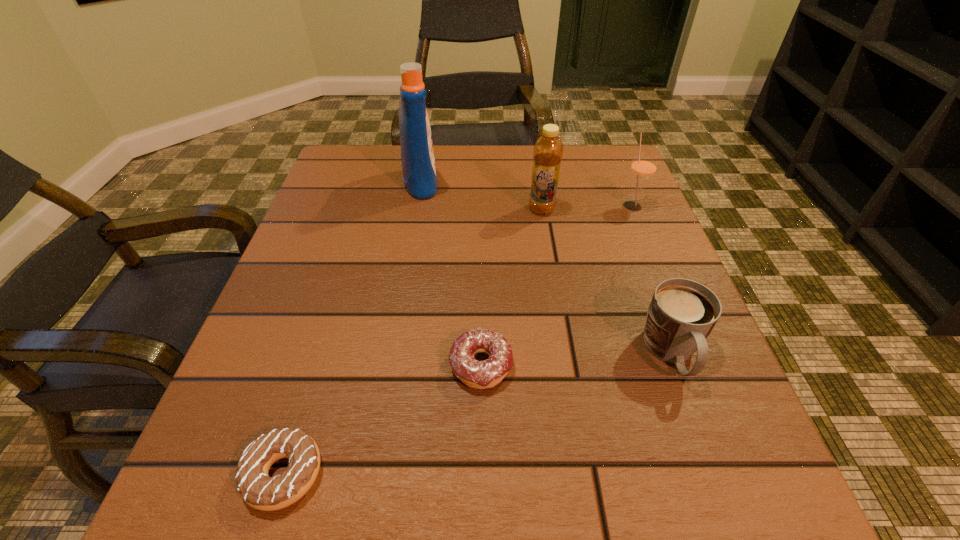
This screenshot has width=960, height=540. In order to click on vacant space at the near right corner of the desktop in this screenshot , I will do pyautogui.click(x=688, y=510).

I want to click on free area in between the fifth shortest object and the third tallest object, so click(x=587, y=207).

Locate an element on the screen. vacant space in between the farther doughnut and the fourth shortest object is located at coordinates (557, 285).

Image resolution: width=960 pixels, height=540 pixels. I want to click on free space between the mug and the straw, so click(652, 279).

Where is `free space between the tallest object and the third tallest object`? This screenshot has height=540, width=960. free space between the tallest object and the third tallest object is located at coordinates (527, 194).

Identify the location of free space between the tallest object and the farther doughnut. This screenshot has height=540, width=960. pos(451,274).

Where is `free space between the nearest object and the farther doughnut`? free space between the nearest object and the farther doughnut is located at coordinates (382, 419).

Identify the location of empty space between the fifth object from right to left and the leftmost object. (352, 328).

I want to click on vacant space that's between the mug and the fourth object from right to left, so click(x=576, y=359).

Identify the location of vacant point located between the mug and the third object from left to right. This screenshot has width=960, height=540. (576, 359).